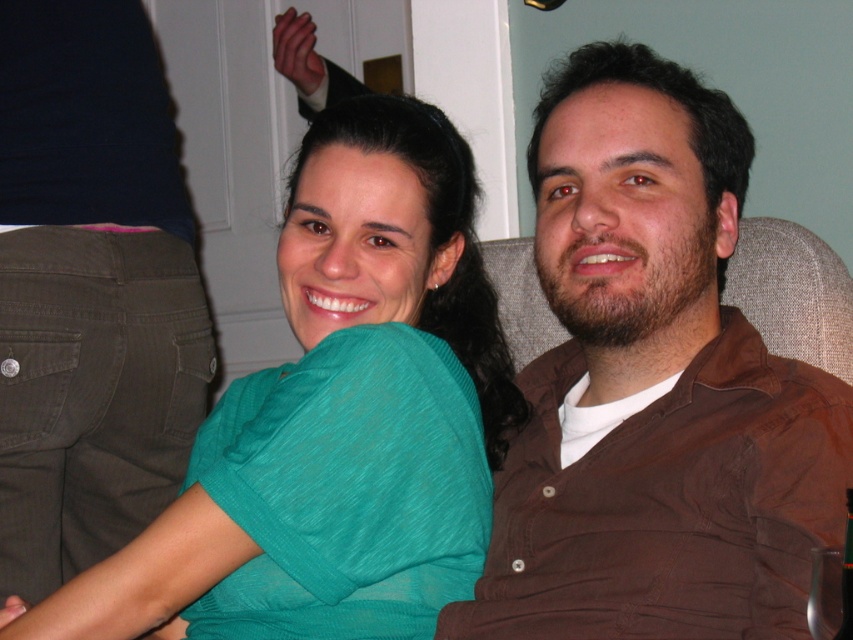
Who is shorter, brown cotton shirt at center or teal jersey at center?

Standing shorter between the two is teal jersey at center.

Is brown cotton shirt at center taller than teal jersey at center?

Correct, brown cotton shirt at center is much taller as teal jersey at center.

Does point (659, 595) come closer to viewer compared to point (457, 572)?

That is True.

Find the location of a particular element. Image resolution: width=853 pixels, height=640 pixels. brown cotton shirt at center is located at coordinates (653, 387).

Is teal jersey at center above brown fabric swivel chair at right?

Incorrect, teal jersey at center is not positioned above brown fabric swivel chair at right.

Based on the photo, is teal jersey at center positioned at the back of brown fabric swivel chair at right?

That is False.

Is point (160, 572) behind point (538, 320)?

No, (160, 572) is in front of (538, 320).

This screenshot has width=853, height=640. I want to click on teal jersey at center, so click(x=345, y=394).

Which of these two, dark green cotton pants at lower left or brown fabric swivel chair at right, stands shorter?

Standing shorter between the two is brown fabric swivel chair at right.

Who is higher up, dark green cotton pants at lower left or brown fabric swivel chair at right?

dark green cotton pants at lower left is above.

Based on the photo, measure the distance between dark green cotton pants at lower left and camera.

They are 4.39 feet apart.

Where is `dark green cotton pants at lower left`? The image size is (853, 640). dark green cotton pants at lower left is located at coordinates (90, 291).